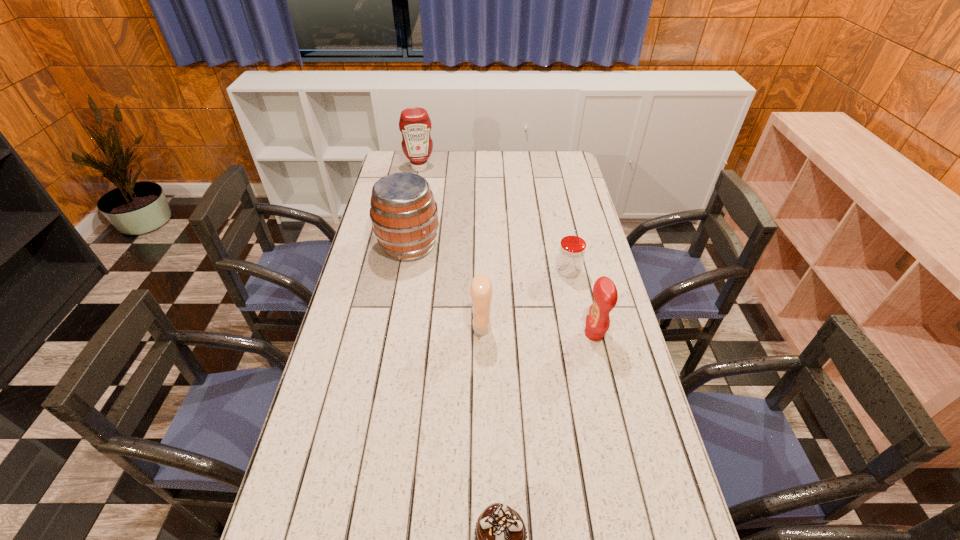
Select which object is the fourth closest to the second condiment from right to left. Please provide its 2D coordinates. Your answer should be formatted as a tuple, i.e. [(x, y)], where the tuple contains the x and y coordinates of a point satisfying the conditions above.

[(500, 537)]

Identify which object is the second closest to the rightmost condiment. Please provide its 2D coordinates. Your answer should be formatted as a tuple, i.e. [(x, y)], where the tuple contains the x and y coordinates of a point satisfying the conditions above.

[(481, 292)]

Locate which condiment is the second closest to the cider. Please provide its 2D coordinates. Your answer should be formatted as a tuple, i.e. [(x, y)], where the tuple contains the x and y coordinates of a point satisfying the conditions above.

[(414, 123)]

Point out which condiment is positioned as the nearest to the rightmost condiment. Please provide its 2D coordinates. Your answer should be formatted as a tuple, i.e. [(x, y)], where the tuple contains the x and y coordinates of a point satisfying the conditions above.

[(481, 292)]